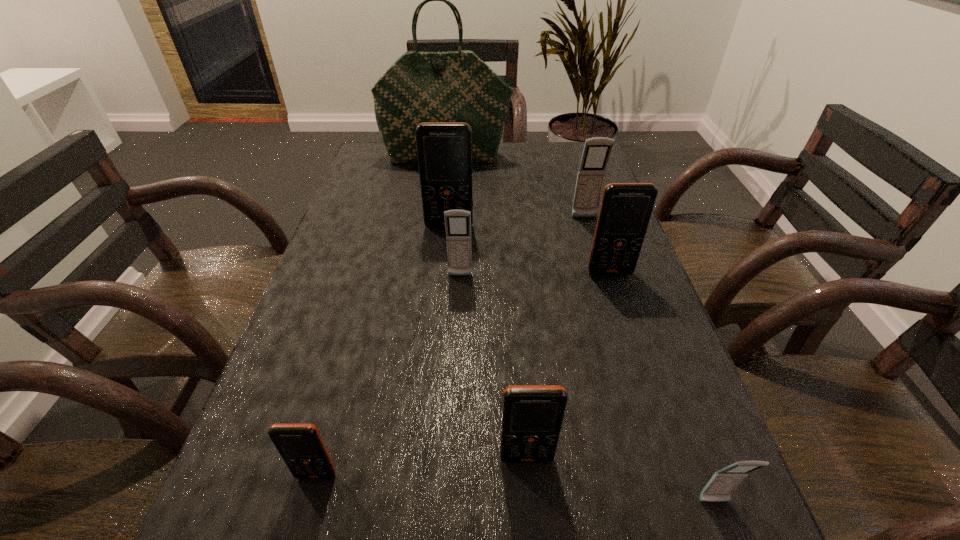
Locate an element on the screen. This screenshot has height=540, width=960. vacant space located 0.090m on the front-facing side of the leftmost gray cellular telephone is located at coordinates (459, 309).

This screenshot has width=960, height=540. I want to click on free location located 0.070m on the screen of the second smallest orange cellular telephone, so click(x=531, y=515).

The image size is (960, 540). Find the location of `object that is at the far edge`. object that is at the far edge is located at coordinates (457, 86).

In order to click on tote bag present at the left edge in this screenshot , I will do `click(457, 86)`.

Where is `cellular telephone located in the left edge section of the desktop`? cellular telephone located in the left edge section of the desktop is located at coordinates (301, 446).

In order to click on object positioned at the far left corner in this screenshot , I will do `click(457, 86)`.

The width and height of the screenshot is (960, 540). Identify the location of vacant space at the far edge of the desktop. (514, 156).

The height and width of the screenshot is (540, 960). I want to click on vacant region at the left edge of the desktop, so click(x=250, y=483).

Locate an element on the screen. The height and width of the screenshot is (540, 960). free space at the right edge of the desktop is located at coordinates (574, 193).

At what (x,y) coordinates should I click in order to perform the action: click on free space between the leftmost orange cellular telephone and the leftmost gray cellular telephone. Please return your answer as a coordinate pair (x, y). The width and height of the screenshot is (960, 540). Looking at the image, I should click on (388, 375).